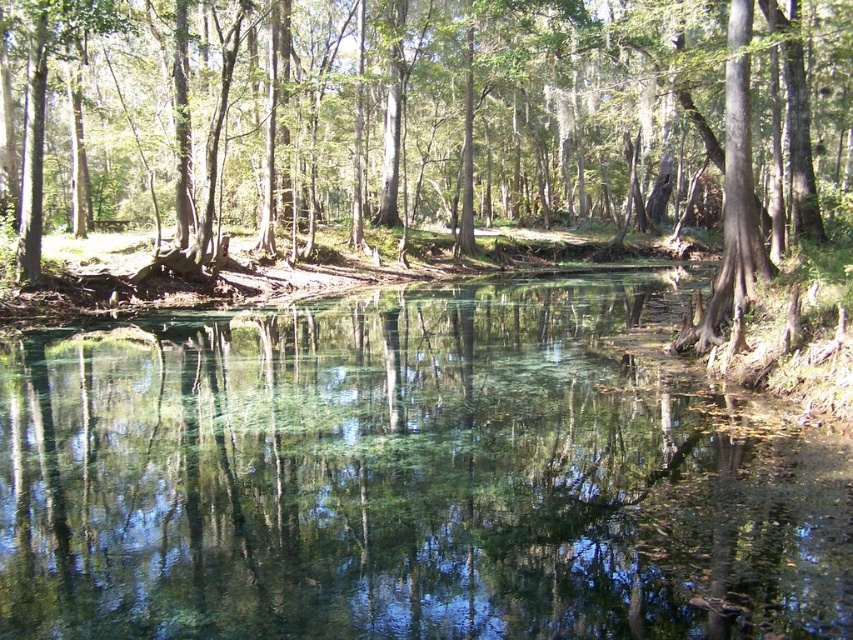
You are standing in the forest and want to cross the clear glass lake at center to reach the green leafy tree at center. Which direction should you head to move from the lake to the tree?

The clear glass lake at center is to the left of green leafy tree at center, so to move from the lake to the tree, you should head to the right.

In the scene shown: You are a hiker who wants to cross the clear glass lake at center to reach the green leafy tree at center. Based on the scene description, can you walk directly across the lake?

The clear glass lake at center occupies less space than the green leafy tree at center, but the scene description mentions that the lake is calm and clear with a sandy bottom, which suggests it might be shallow. However, since the lake is described as occupying less space than the tree, it is possible that the lake is small enough to walk across, but the presence of submerged vegetation and a sandy bottom indicates it might be navigable. However, without specific depth information, it is uncertain. The hik

You are a hiker who wants to cross the clear glass lake at center to reach the green leafy tree at center. Can you walk directly across the lake?

The clear glass lake at center is thinner than the green leafy tree at center. However, since the lake is a body of water, you cannot walk directly across it to reach the tree.